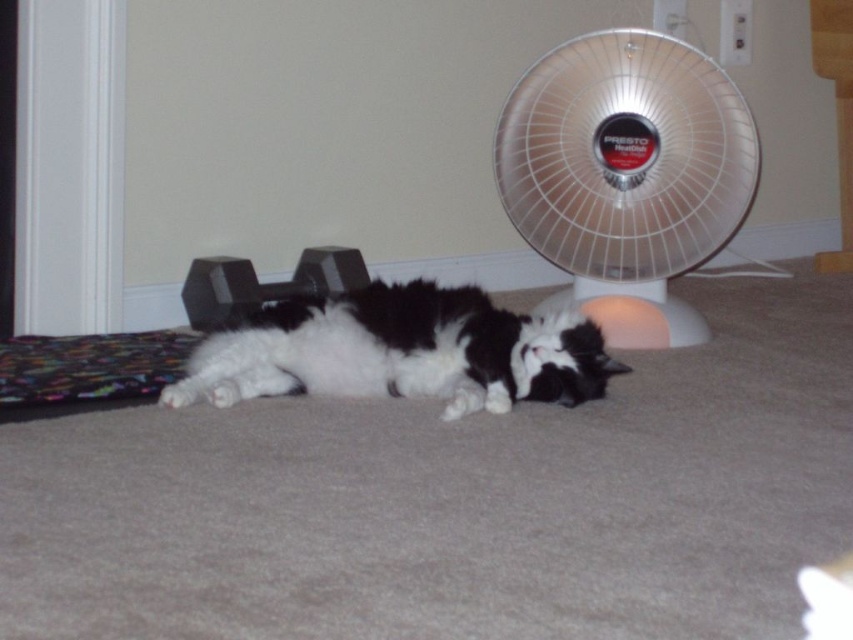
You are a delivery person entering the room and need to place a package on the white plastic fan at center without disturbing the fluffy white cat at center. Can you safely place the package there?

The white plastic fan at center is further to the viewer than the fluffy white cat at center, so you can safely place the package on the white plastic fan at center without disturbing the cat since it is closer to you.

Based on the photo, you are trying to place a new rug in the room. The rug needs to be placed between the white plastic fan at center and the two black dumbbells. According to the coordinates provided, is the rug closer to the fan or the dumbbells?

The white plastic fan at center is located at point (627, 173). Since the dumbbells are to the left of the cat and the fan is on the right side of the frame, the coordinates indicate the fan is positioned further right. Therefore, the rug placed between them would be closer to the fan as it occupies the right side of the frame, while the dumbbells are on the left.

You are a photographer standing in front of the fluffy white cat at center. You want to take a closeup photo of the cat without moving the camera. Is the cat within the focus range of your camera, which has a minimum focusing distance of 1.5 meters?

The distance between the fluffy white cat at center and the camera is 1.86 meters. Since the camera can focus as close as 1.5 meters, the cat is within the focus range and can be captured clearly in the closeup photo.